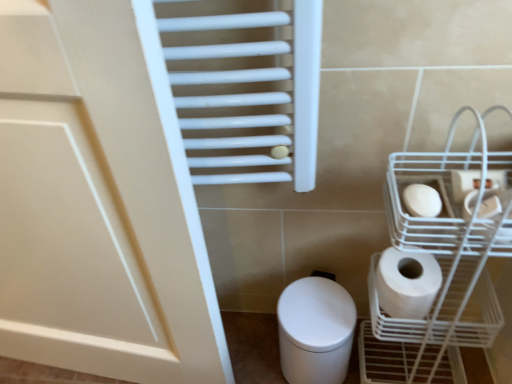
Question: Is white matte toilet paper at lower right, the third toilet paper when ordered from top to bottom, further to the viewer compared to white matte toilet paper at right, placed as the 3th toilet paper when sorted from bottom to top?

Choices:
 (A) no
 (B) yes

Answer: (B)

Question: Is white matte toilet paper at lower right, the third toilet paper when ordered from top to bottom, at the left side of white matte toilet paper at right, placed as the 3th toilet paper when sorted from bottom to top?

Choices:
 (A) no
 (B) yes

Answer: (B)

Question: Are white matte toilet paper at lower right, the first toilet paper in the bottom-to-top sequence, and white matte toilet paper at right, which is the 1th toilet paper in top-to-bottom order, located far from each other?

Choices:
 (A) yes
 (B) no

Answer: (B)

Question: Is white matte toilet paper at right, placed as the 3th toilet paper when sorted from bottom to top, located within white matte toilet paper at lower right, the third toilet paper when ordered from top to bottom?

Choices:
 (A) yes
 (B) no

Answer: (B)

Question: From a real-world perspective, is white matte toilet paper at lower right, the third toilet paper when ordered from top to bottom, below white matte toilet paper at right, which is the 1th toilet paper in top-to-bottom order?

Choices:
 (A) yes
 (B) no

Answer: (A)

Question: Could you tell me if white matte toilet paper at lower right, the first toilet paper in the bottom-to-top sequence, is facing white matte toilet paper at right, which is the 1th toilet paper in top-to-bottom order?

Choices:
 (A) no
 (B) yes

Answer: (A)

Question: Does white matte toilet paper at right, which is counted as the second toilet paper, starting from the top, touch white wire basket at lower right?

Choices:
 (A) yes
 (B) no

Answer: (B)

Question: Considering the relative sizes of white matte toilet paper at right, which is counted as the second toilet paper, starting from the top, and white wire basket at lower right in the image provided, is white matte toilet paper at right, which is counted as the second toilet paper, starting from the top, wider than white wire basket at lower right?

Choices:
 (A) no
 (B) yes

Answer: (A)

Question: Is white matte toilet paper at right, which is the 2th toilet paper from bottom to top, oriented away from white wire basket at lower right?

Choices:
 (A) yes
 (B) no

Answer: (A)

Question: Does white matte toilet paper at right, which is the 2th toilet paper from bottom to top, have a larger size compared to white wire basket at lower right?

Choices:
 (A) yes
 (B) no

Answer: (B)

Question: Is white matte toilet paper at right, which is counted as the second toilet paper, starting from the top, thinner than white wire basket at lower right?

Choices:
 (A) no
 (B) yes

Answer: (B)

Question: Is white matte toilet paper at right, placed as the 3th toilet paper when sorted from bottom to top, next to white matte toilet paper at lower right, the first toilet paper in the bottom-to-top sequence?

Choices:
 (A) no
 (B) yes

Answer: (A)